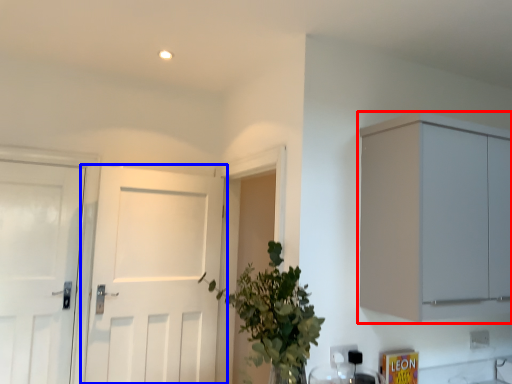
Question: Which of the following is the farthest to the observer, cabinetry (highlighted by a red box) or door (highlighted by a blue box)?

Choices:
 (A) cabinetry
 (B) door

Answer: (B)